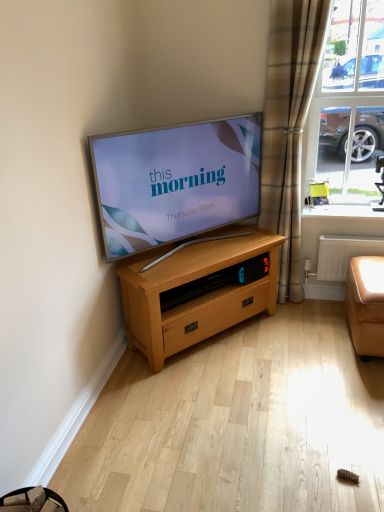
You are a GUI agent. You are given a task and a screenshot of the screen. Output one action in this format:
    pyautogui.click(x=<x>, y=<y>)
    Task: Click on the free space between light oak wooden chest of drawers at center and leather-like orange couch at lower right
    The width and height of the screenshot is (384, 512).
    Given the screenshot: What is the action you would take?
    pyautogui.click(x=279, y=340)